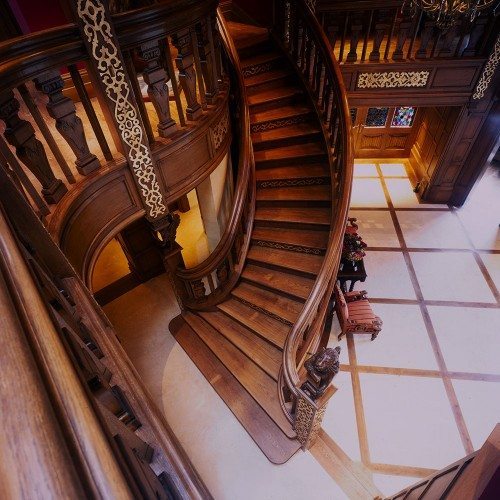
Image resolution: width=500 pixels, height=500 pixels. In order to click on sofa in this screenshot , I will do `click(356, 313)`.